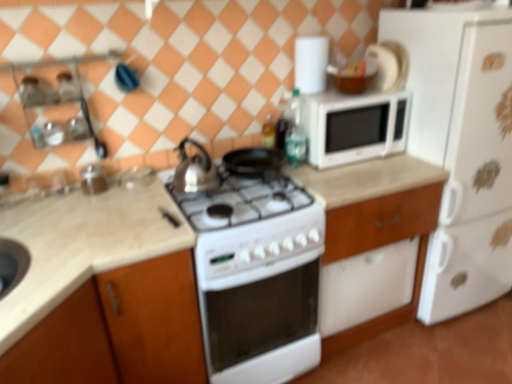
Where is `free space in front of green glass bottle at upper right, marked as the second bottle in a left-to-right arrangement`? The image size is (512, 384). free space in front of green glass bottle at upper right, marked as the second bottle in a left-to-right arrangement is located at coordinates (315, 174).